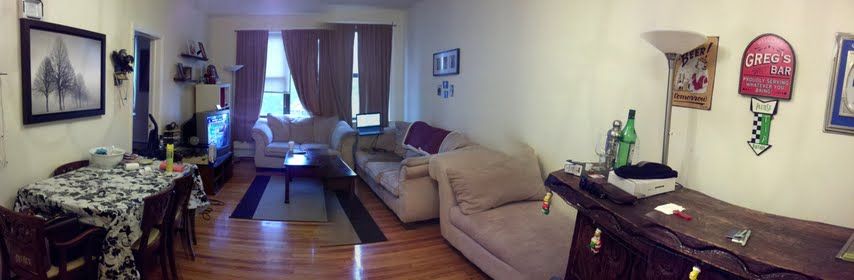
You are a GUI agent. You are given a task and a screenshot of the screen. Output one action in this format:
    pyautogui.click(x=<x>, y=<y>)
    Task: Click on the wall decor
    
    Given the screenshot: What is the action you would take?
    pyautogui.click(x=74, y=76), pyautogui.click(x=120, y=69), pyautogui.click(x=196, y=77), pyautogui.click(x=199, y=53), pyautogui.click(x=703, y=77), pyautogui.click(x=775, y=72), pyautogui.click(x=834, y=114), pyautogui.click(x=448, y=62), pyautogui.click(x=446, y=89)